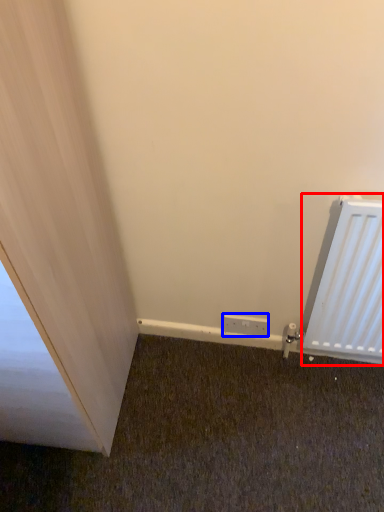
Question: Which object is further to the camera taking this photo, radiator (highlighted by a red box) or electric outlet (highlighted by a blue box)?

Choices:
 (A) radiator
 (B) electric outlet

Answer: (B)